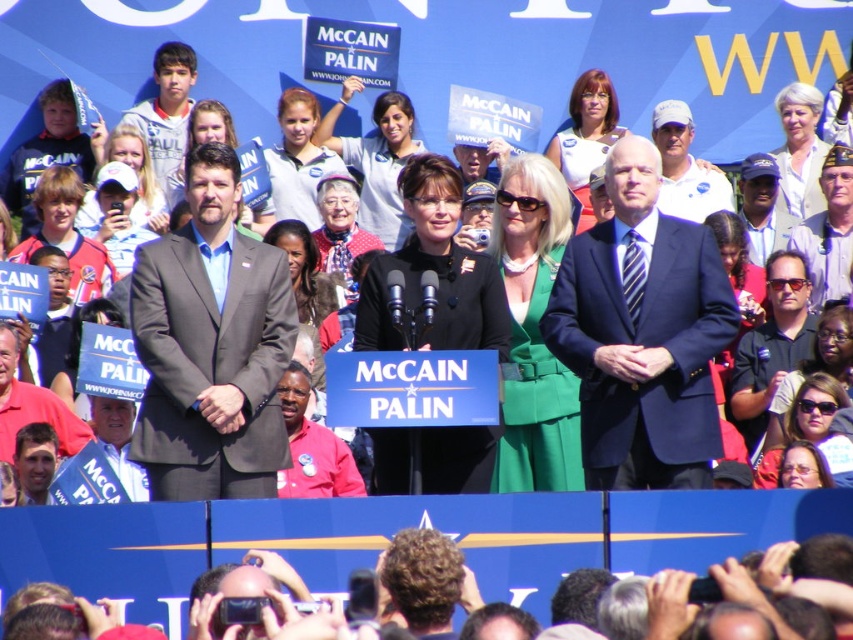
Does gray suit at left appear on the left side of matte black podium at center?

Indeed, gray suit at left is positioned on the left side of matte black podium at center.

Between gray suit at left and matte black podium at center, which one is positioned lower?

gray suit at left is below.

What do you see at coordinates (212, 346) in the screenshot? This screenshot has width=853, height=640. I see `gray suit at left` at bounding box center [212, 346].

Where is `gray suit at left`? The image size is (853, 640). gray suit at left is located at coordinates (212, 346).

Is black shirt at center smaller than khaki uniform at center?

No.

You are a GUI agent. You are given a task and a screenshot of the screen. Output one action in this format:
    pyautogui.click(x=<x>, y=<y>)
    Task: Click on the black shirt at center
    The width and height of the screenshot is (853, 640).
    Given the screenshot: What is the action you would take?
    pyautogui.click(x=770, y=344)

Where is `black shirt at center`? black shirt at center is located at coordinates coord(770,344).

Is point (581, 195) positioned before point (799, 268)?

No.

Is matte black podium at center thinner than black shirt at center?

In fact, matte black podium at center might be wider than black shirt at center.

Is point (680, 129) more distant than point (762, 420)?

Yes, it is.

Where is `matte black podium at center`? Image resolution: width=853 pixels, height=640 pixels. matte black podium at center is located at coordinates (376, 173).